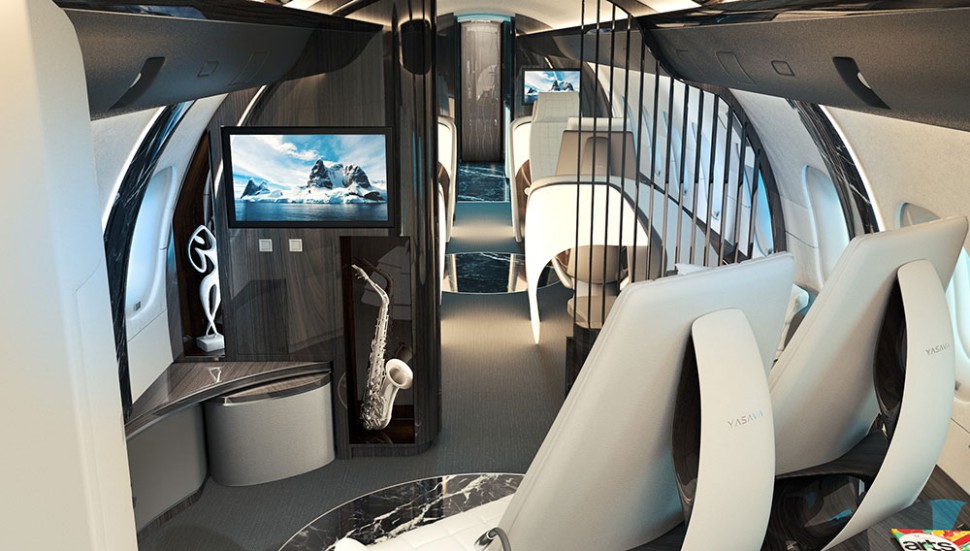
Locate an element on the screen. This screenshot has height=551, width=970. blue sky on tv is located at coordinates (312, 147), (561, 73).